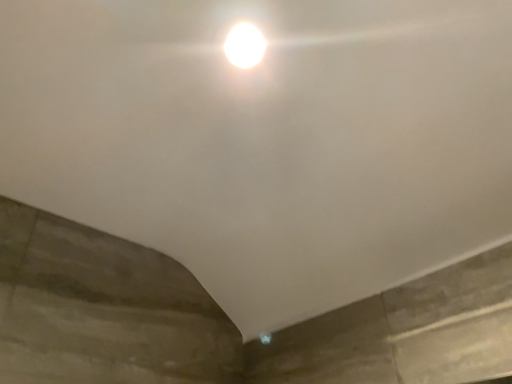
What do you see at coordinates (245, 45) in the screenshot? Image resolution: width=512 pixels, height=384 pixels. I see `white glossy sphere at upper center` at bounding box center [245, 45].

Find the location of a particular element. white glossy sphere at upper center is located at coordinates (245, 45).

What is the approximate height of white glossy sphere at upper center?

white glossy sphere at upper center is 0.48 inches in height.

The height and width of the screenshot is (384, 512). Identify the location of white glossy sphere at upper center. (245, 45).